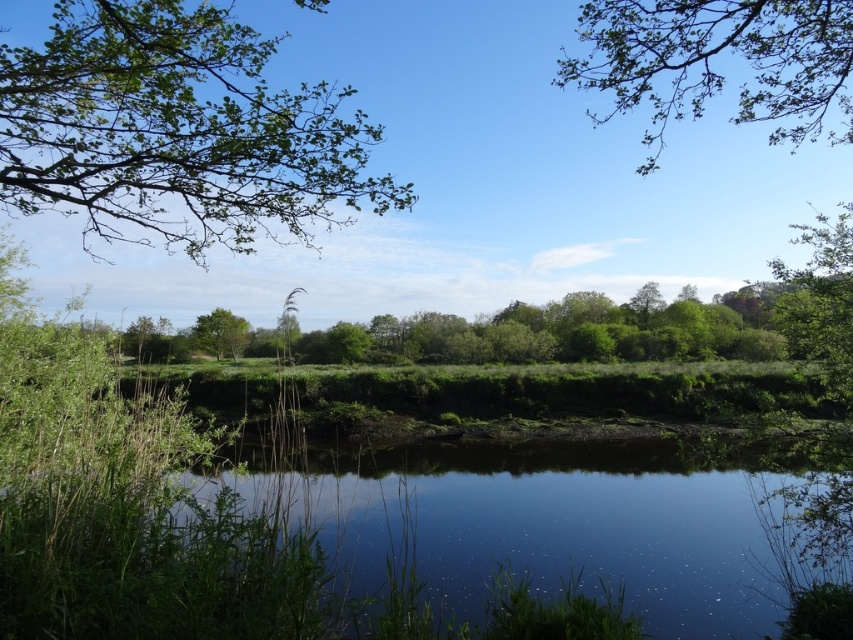
Does green leafy branches at upper left have a greater height compared to green leafy branches at upper right?

In fact, green leafy branches at upper left may be shorter than green leafy branches at upper right.

Between point (186, 202) and point (653, 58), which one is positioned in front?

Positioned in front is point (653, 58).

Locate an element on the screen. The height and width of the screenshot is (640, 853). green leafy branches at upper left is located at coordinates (177, 131).

Identify the location of green leafy branches at upper left. (177, 131).

Looking at this image, between green leafy branches at upper right and green leafy tree at center, which one has less height?

green leafy tree at center is shorter.

Does green leafy branches at upper right have a larger size compared to green leafy tree at center?

Yes.

What do you see at coordinates (712, 61) in the screenshot? This screenshot has width=853, height=640. I see `green leafy branches at upper right` at bounding box center [712, 61].

This screenshot has height=640, width=853. I want to click on green leafy branches at upper right, so click(712, 61).

Who is positioned more to the left, green leafy branches at upper left or green leafy tree at center?

green leafy tree at center

Between green leafy branches at upper left and green leafy tree at center, which one is positioned lower?

green leafy tree at center

Where is `green leafy branches at upper left`? The height and width of the screenshot is (640, 853). green leafy branches at upper left is located at coordinates (177, 131).